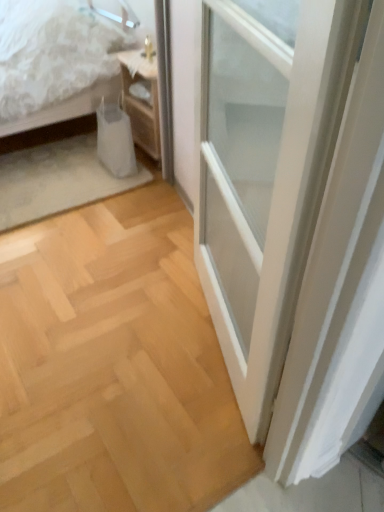
Question: Does woodenmaterial/texturenightstand at upper left appear on the right side of white textured bed at upper left?

Choices:
 (A) no
 (B) yes

Answer: (B)

Question: Is woodenmaterial/texturenightstand at upper left directly adjacent to white textured bed at upper left?

Choices:
 (A) no
 (B) yes

Answer: (A)

Question: From a real-world perspective, is woodenmaterial/texturenightstand at upper left below white textured bed at upper left?

Choices:
 (A) no
 (B) yes

Answer: (B)

Question: Can white textured bed at upper left be found inside woodenmaterial/texturenightstand at upper left?

Choices:
 (A) no
 (B) yes

Answer: (A)

Question: Is the depth of woodenmaterial/texturenightstand at upper left less than that of white textured bed at upper left?

Choices:
 (A) no
 (B) yes

Answer: (A)

Question: Does woodenmaterial/texturenightstand at upper left have a lesser height compared to white textured bed at upper left?

Choices:
 (A) no
 (B) yes

Answer: (B)

Question: From a real-world perspective, is white textured bed at upper left positioned under woodenmaterial/texturenightstand at upper left based on gravity?

Choices:
 (A) no
 (B) yes

Answer: (A)

Question: From the image's perspective, is white textured bed at upper left below woodenmaterial/texturenightstand at upper left?

Choices:
 (A) yes
 (B) no

Answer: (B)

Question: Is white textured bed at upper left oriented towards woodenmaterial/texturenightstand at upper left?

Choices:
 (A) no
 (B) yes

Answer: (A)

Question: Is the depth of white textured bed at upper left less than that of woodenmaterial/texturenightstand at upper left?

Choices:
 (A) yes
 (B) no

Answer: (A)

Question: Is white textured bed at upper left to the right of woodenmaterial/texturenightstand at upper left from the viewer's perspective?

Choices:
 (A) no
 (B) yes

Answer: (A)

Question: From a real-world perspective, is white textured bed at upper left positioned over woodenmaterial/texturenightstand at upper left based on gravity?

Choices:
 (A) yes
 (B) no

Answer: (A)

Question: Is white textured bed at upper left to the left or to the right of woodenmaterial/texturenightstand at upper left in the image?

Choices:
 (A) right
 (B) left

Answer: (B)